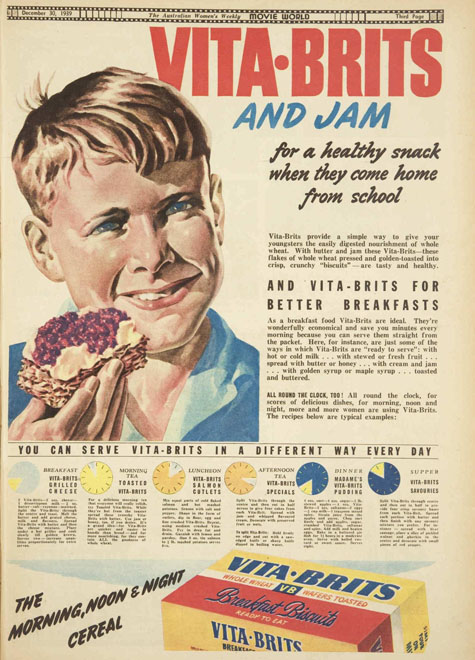
Identify the location of box. Image resolution: width=475 pixels, height=660 pixels. (269, 597).